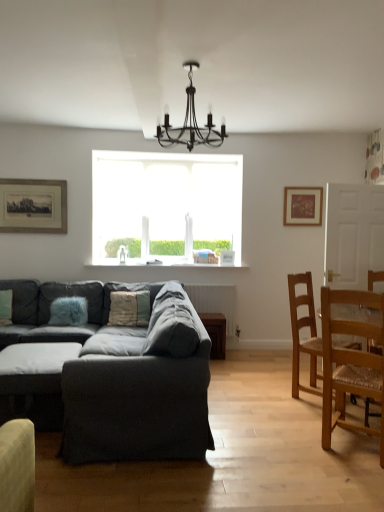
Question: Is black metal chandelier at upper center inside or outside of textured beige pillow at center, arranged as the 1th pillow when viewed from the right?

Choices:
 (A) inside
 (B) outside

Answer: (B)

Question: From a real-world perspective, is black metal chandelier at upper center above or below textured beige pillow at center, arranged as the 1th pillow when viewed from the right?

Choices:
 (A) below
 (B) above

Answer: (B)

Question: Which of these objects is positioned farthest from the black metal chandelier at upper center?

Choices:
 (A) textured gray couch at center
 (B) wooden framed print at upper left, which is counted as the 1th picture frame, starting from the front
 (C) dark gray fabric ottoman at lower left
 (D) textured beige pillow at center, the 2th pillow positioned from the left
 (E) fuzzy blue pillow at left, the second pillow from the right

Answer: (B)

Question: Estimate the real-world distances between objects in this image. Which object is farther from the white frosted glass window at center?

Choices:
 (A) wooden framed print at upper left, positioned as the second picture frame in right-to-left order
 (B) light brown wooden chair at right, the 1th chair viewed from the front
 (C) wooden picture frame at upper right, which ranks as the 1th picture frame in back-to-front order
 (D) fuzzy blue pillow at left, which is counted as the 1th pillow, starting from the left
 (E) textured beige pillow at center, the 2th pillow positioned from the left

Answer: (B)